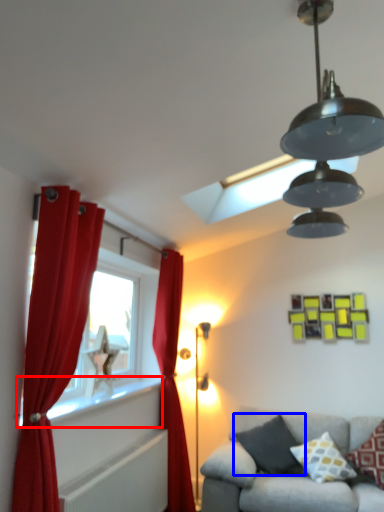
Question: Which object appears farthest to the camera in this image, window sill (highlighted by a red box) or pillow (highlighted by a blue box)?

Choices:
 (A) window sill
 (B) pillow

Answer: (B)